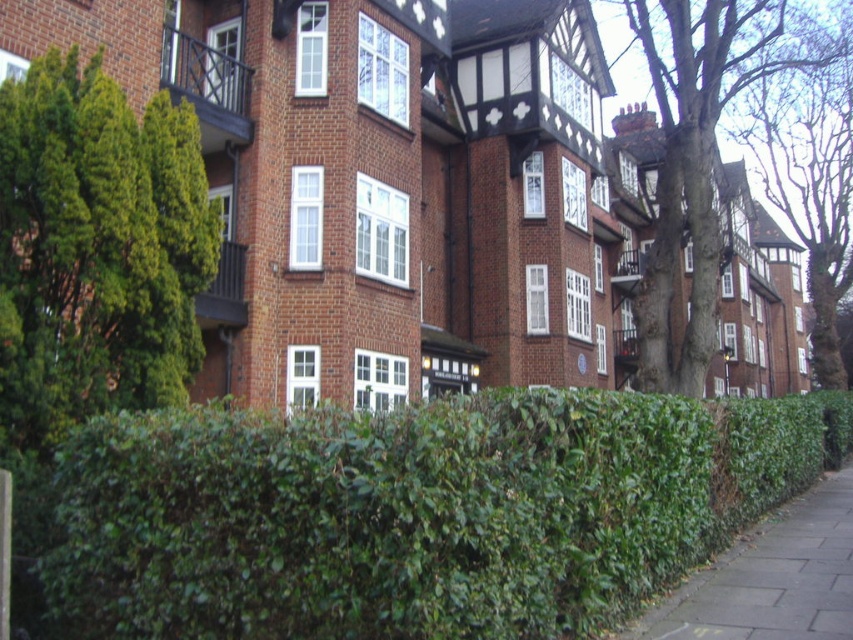
Can you confirm if green leafy tree at left is thinner than bare bark tree at upper right?

Yes.

Who is more forward, (114, 214) or (706, 84)?

Point (114, 214)

Describe the element at coordinates (96, 250) in the screenshot. I see `green leafy tree at left` at that location.

Locate an element on the screen. The width and height of the screenshot is (853, 640). green leafy tree at left is located at coordinates (96, 250).

Who is shorter, green leafy tree at left or green grassy hedge at lower right?

Standing shorter between the two is green grassy hedge at lower right.

Is point (1, 154) closer to viewer compared to point (844, 592)?

Yes, it is in front of point (844, 592).

Where is `green leafy tree at left`? Image resolution: width=853 pixels, height=640 pixels. green leafy tree at left is located at coordinates (96, 250).

Based on the photo, is green leafy hedge at center to the left of green leafy tree at left from the viewer's perspective?

Incorrect, green leafy hedge at center is not on the left side of green leafy tree at left.

Does green leafy hedge at center have a larger size compared to green leafy tree at left?

Yes.

What do you see at coordinates (415, 513) in the screenshot?
I see `green leafy hedge at center` at bounding box center [415, 513].

Image resolution: width=853 pixels, height=640 pixels. What are the coordinates of `green leafy hedge at center` in the screenshot? It's located at (415, 513).